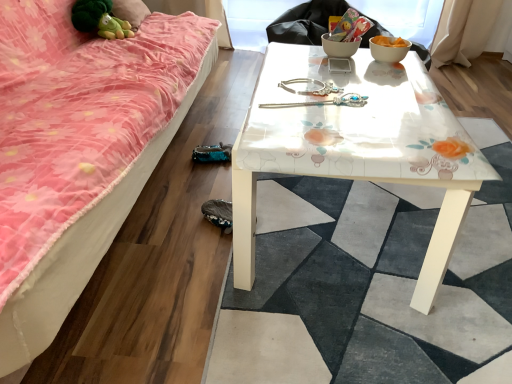
In order to click on vacant location behind silver metallic hairpin at center in this screenshot , I will do `click(298, 79)`.